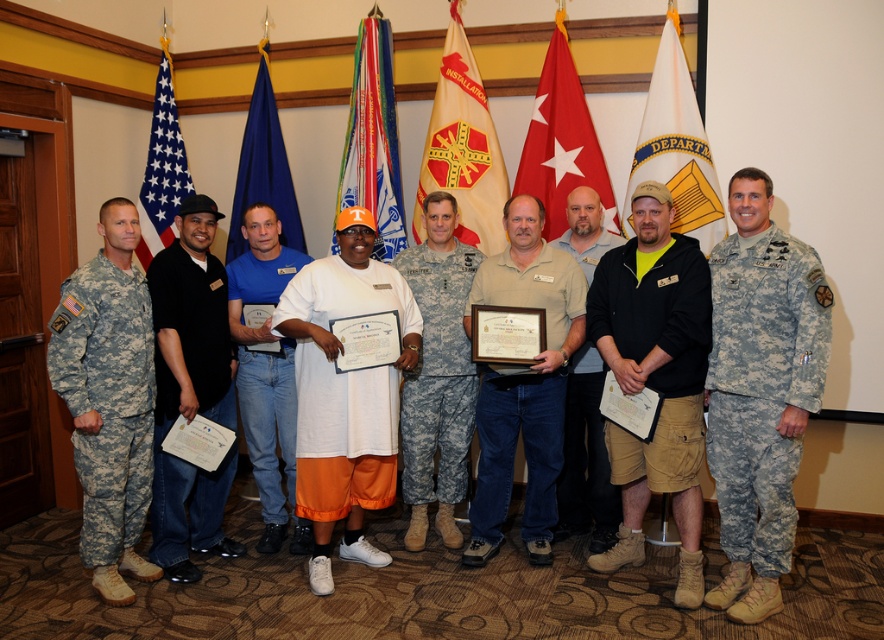
Question: Can you confirm if beige cotton shirt at center is positioned to the right of white cotton shirt at center?

Choices:
 (A) no
 (B) yes

Answer: (B)

Question: Is the position of black matte jacket at center more distant than that of multicolored fabric banner at center?

Choices:
 (A) yes
 (B) no

Answer: (B)

Question: Does black matte shirt at center have a greater width compared to white fabric flag at center?

Choices:
 (A) no
 (B) yes

Answer: (A)

Question: Which object appears farthest from the camera in this image?

Choices:
 (A) beige cotton shirt at center
 (B) black matte jacket at center
 (C) white fabric flag at center
 (D) gold metallic flag at center

Answer: (D)

Question: Which is farther from the white fabric flag at center?

Choices:
 (A) white cotton shirt at center
 (B) gold metallic flag at center
 (C) camouflage fabric uniform at right
 (D) beige cotton shirt at center

Answer: (A)

Question: Which of these objects is positioned closest to the white cotton shirt at center?

Choices:
 (A) camouflage fabric uniform at left
 (B) multicolored fabric banner at center
 (C) gold metallic flag at center

Answer: (A)